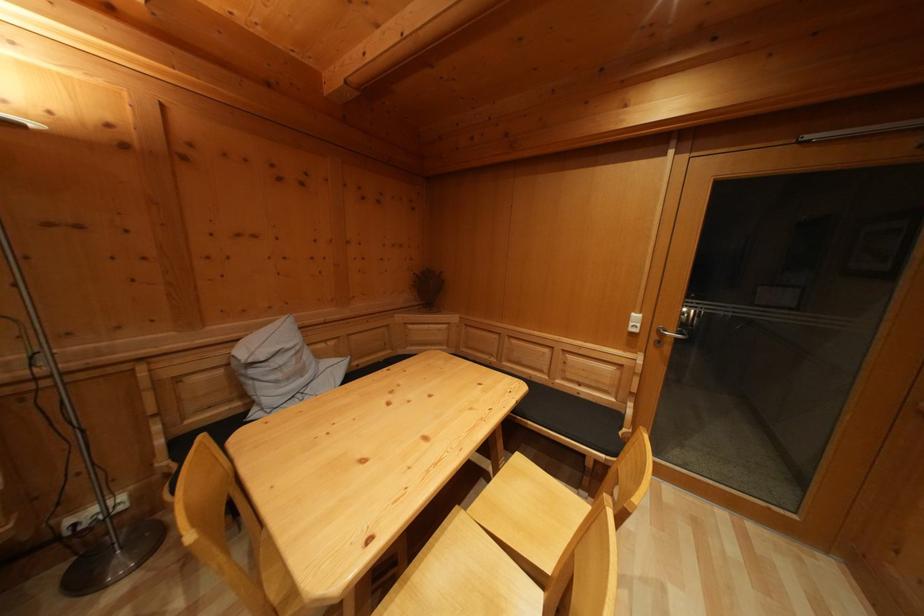
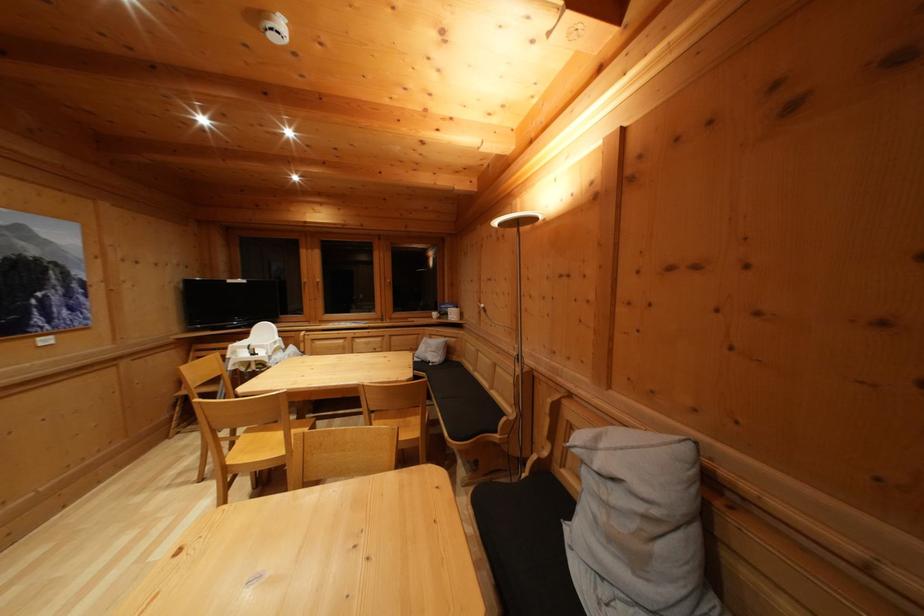
In the second image, find the point that corresponds to (x=306, y=379) in the first image.

(640, 565)